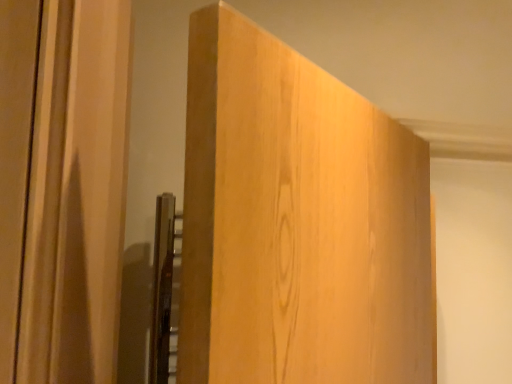
Measure the distance between point (0, 329) and camera.

Point (0, 329) is 12.56 inches from camera.

Locate an element on the screen. matte wood screen door at left is located at coordinates (62, 187).

This screenshot has height=384, width=512. Describe the element at coordinates (62, 187) in the screenshot. I see `matte wood screen door at left` at that location.

The height and width of the screenshot is (384, 512). Identify the location of matte wood screen door at left. (62, 187).